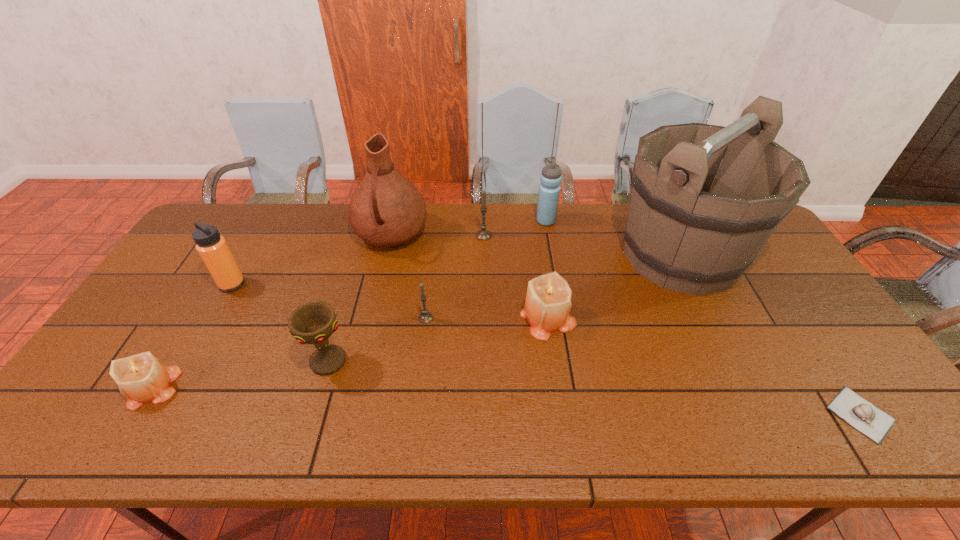
The width and height of the screenshot is (960, 540). Identify the location of free spot located on the left of the right beige candle. (406, 316).

Where is `vacant space situated 0.260m on the left of the smaller gray candle`? vacant space situated 0.260m on the left of the smaller gray candle is located at coordinates (325, 318).

At what (x,y) coordinates should I click in order to perform the action: click on vacant region located 0.340m on the back of the left beige candle. Please return your answer as a coordinate pair (x, y). The width and height of the screenshot is (960, 540). Looking at the image, I should click on (225, 273).

Locate an element on the screen. The height and width of the screenshot is (540, 960). vacant space situated 0.160m on the left of the shortest object is located at coordinates (759, 414).

Identify the location of bucket at the far edge. Image resolution: width=960 pixels, height=540 pixels. (679, 234).

Find the location of a particular element. This screenshot has height=540, width=960. pitcher that is at the far edge is located at coordinates (386, 209).

Identify the location of water bottle that is positioned at the far edge. (549, 190).

This screenshot has height=540, width=960. What are the coordinates of `candle located in the far edge section of the desktop` in the screenshot? It's located at (483, 234).

Locate an element on the screen. object positioned at the near edge is located at coordinates (867, 418).

At what (x,y) coordinates should I click in order to perform the action: click on object that is at the left edge. Please return your answer as a coordinate pair (x, y). Looking at the image, I should click on (142, 378).